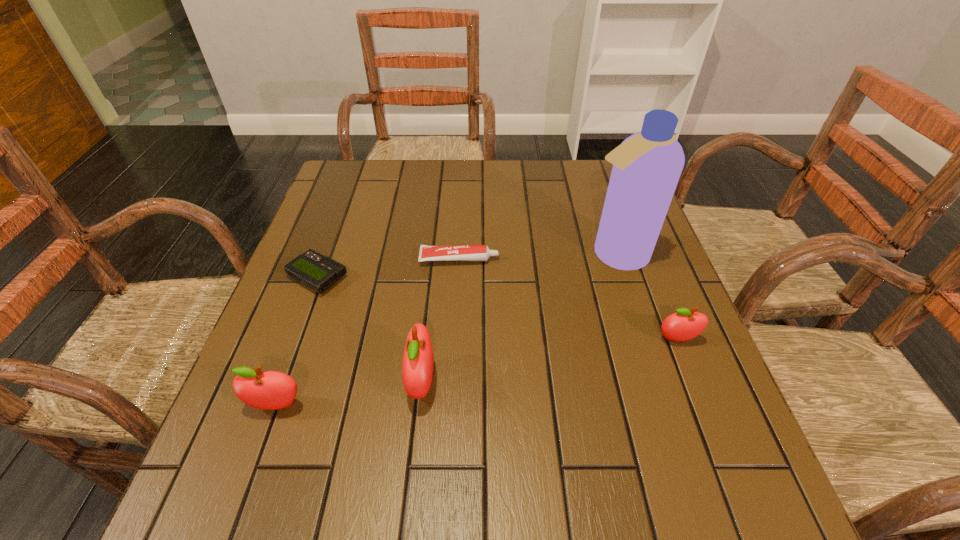
Find the location of a particular element. The height and width of the screenshot is (540, 960). free space at the far edge of the desktop is located at coordinates (384, 194).

Identify the location of free point at the near edge. (612, 416).

Locate an element on the screen. The image size is (960, 540). vacant space at the left edge is located at coordinates (281, 335).

Locate an element on the screen. free point at the right edge is located at coordinates (644, 383).

In order to click on vacant area at the near left corner in this screenshot , I will do `click(245, 419)`.

This screenshot has width=960, height=540. Find the location of `vacant area at the far right corner of the desktop`. vacant area at the far right corner of the desktop is located at coordinates (599, 175).

Identify the location of vacant space at the near right corner of the desktop. The width and height of the screenshot is (960, 540). (722, 403).

Identify the location of free spot between the beeper and the toothpaste. Image resolution: width=960 pixels, height=540 pixels. (389, 268).

Locate an element on the screen. Image resolution: width=960 pixels, height=540 pixels. vacant space that's between the shampoo and the toothpaste is located at coordinates (537, 257).

Identify the location of free space between the second apple from right to left and the toothpaste. This screenshot has height=540, width=960. (441, 320).